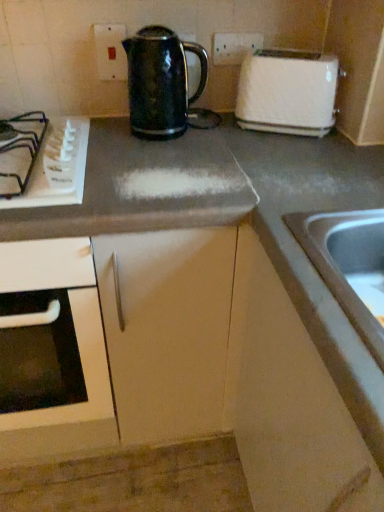
Question: Are shiny black kettle at center and matte white electric outlet at upper center located far from each other?

Choices:
 (A) no
 (B) yes

Answer: (A)

Question: Considering the relative positions of shiny black kettle at center and matte white electric outlet at upper center in the image provided, is shiny black kettle at center in front of matte white electric outlet at upper center?

Choices:
 (A) no
 (B) yes

Answer: (B)

Question: Is shiny black kettle at center oriented away from matte white electric outlet at upper center?

Choices:
 (A) yes
 (B) no

Answer: (B)

Question: Can you confirm if shiny black kettle at center is thinner than matte white electric outlet at upper center?

Choices:
 (A) yes
 (B) no

Answer: (B)

Question: From the image's perspective, is shiny black kettle at center above matte white electric outlet at upper center?

Choices:
 (A) yes
 (B) no

Answer: (B)

Question: Is point coord(36,159) closer or farther from the camera than point coord(137,420)?

Choices:
 (A) farther
 (B) closer

Answer: (B)

Question: Considering the positions of white plastic gas stove at left and matte gray cabinet at center, arranged as the 2th cabinetry when viewed from the right, in the image, is white plastic gas stove at left taller or shorter than matte gray cabinet at center, arranged as the 2th cabinetry when viewed from the right,?

Choices:
 (A) short
 (B) tall

Answer: (A)

Question: Would you say white plastic gas stove at left is to the left or to the right of matte gray cabinet at center, placed as the 1th cabinetry when sorted from left to right, in the picture?

Choices:
 (A) right
 (B) left

Answer: (B)

Question: From the image's perspective, relative to matte gray cabinet at center, arranged as the 2th cabinetry when viewed from the right, is white plastic gas stove at left above or below?

Choices:
 (A) below
 (B) above

Answer: (B)

Question: From a real-world perspective, is stainless steel sink at lower right positioned above or below matte gray cabinet at center, placed as the 1th cabinetry when sorted from left to right?

Choices:
 (A) below
 (B) above

Answer: (B)

Question: Considering the positions of point (334, 211) and point (196, 272), is point (334, 211) closer or farther from the camera than point (196, 272)?

Choices:
 (A) farther
 (B) closer

Answer: (B)

Question: From their relative heights in the image, would you say stainless steel sink at lower right is taller or shorter than matte gray cabinet at center, arranged as the 2th cabinetry when viewed from the right?

Choices:
 (A) short
 (B) tall

Answer: (A)

Question: From the image's perspective, is stainless steel sink at lower right above or below matte gray cabinet at center, arranged as the 2th cabinetry when viewed from the right?

Choices:
 (A) above
 (B) below

Answer: (A)

Question: From a real-world perspective, is shiny black kettle at center positioned above or below white plastic gas stove at left?

Choices:
 (A) above
 (B) below

Answer: (A)

Question: Do you think shiny black kettle at center is within white plastic gas stove at left, or outside of it?

Choices:
 (A) outside
 (B) inside

Answer: (A)